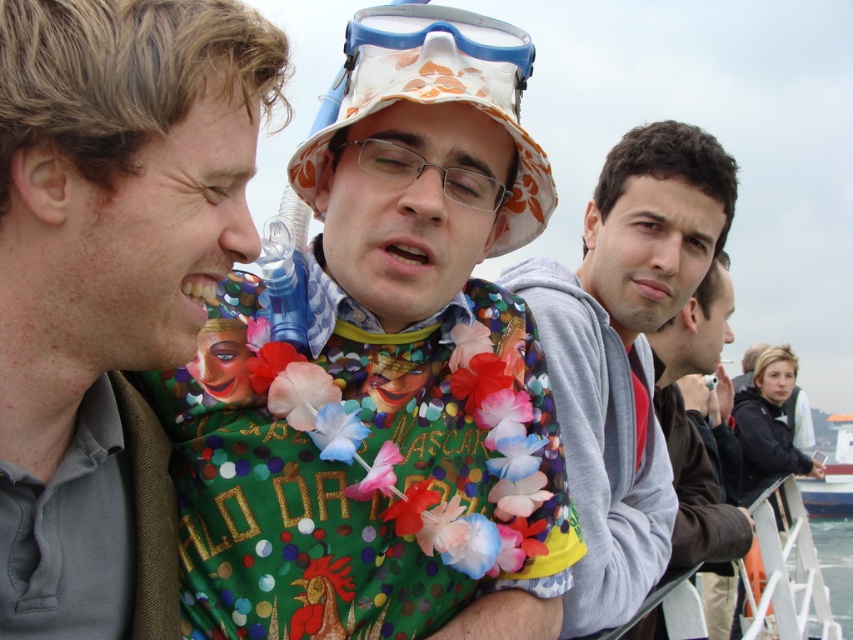
Is point (187, 204) positioned in front of point (816, 515)?

Yes.

Who is more distant from viewer, (111, 337) or (810, 504)?

The point (810, 504) is behind.

Is point (41, 157) closer to camera compared to point (849, 452)?

Yes, it is.

Locate an element on the screen. This screenshot has height=640, width=853. green fabric shirt at center is located at coordinates (109, 284).

Does green fabric shirt at center have a lesser height compared to gray fleece jacket at center?

Yes, green fabric shirt at center is shorter than gray fleece jacket at center.

Is green fabric shirt at center positioned before gray fleece jacket at center?

Yes, it is.

Is point (206, 6) positioned before point (646, 496)?

Yes, it is in front of point (646, 496).

Where is `green fabric shirt at center`? This screenshot has height=640, width=853. green fabric shirt at center is located at coordinates (109, 284).

The image size is (853, 640). What do you see at coordinates (624, 352) in the screenshot?
I see `gray fleece jacket at center` at bounding box center [624, 352].

Is gray fleece jacket at center shorter than matte black jacket at right?

Correct, gray fleece jacket at center is not as tall as matte black jacket at right.

Identify the location of gray fleece jacket at center. Image resolution: width=853 pixels, height=640 pixels. (624, 352).

The height and width of the screenshot is (640, 853). In order to click on gray fleece jacket at center in this screenshot , I will do `click(624, 352)`.